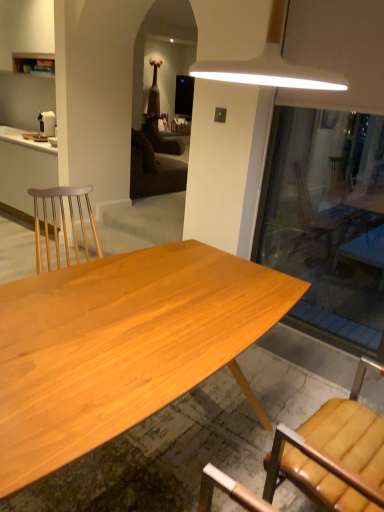
Question: Is matte white cabinet at left aimed at white plastic coffee maker at left?

Choices:
 (A) no
 (B) yes

Answer: (A)

Question: Is matte white cabinet at left positioned far away from white plastic coffee maker at left?

Choices:
 (A) no
 (B) yes

Answer: (A)

Question: Is the surface of matte white cabinet at left in direct contact with white plastic coffee maker at left?

Choices:
 (A) yes
 (B) no

Answer: (B)

Question: Is matte white cabinet at left looking in the opposite direction of white plastic coffee maker at left?

Choices:
 (A) no
 (B) yes

Answer: (A)

Question: Can you confirm if matte white cabinet at left is shorter than white plastic coffee maker at left?

Choices:
 (A) yes
 (B) no

Answer: (B)

Question: Is matte white cabinet at left thinner than white plastic coffee maker at left?

Choices:
 (A) no
 (B) yes

Answer: (A)

Question: Is natural wood desk at center a part of white plastic coffee maker at left?

Choices:
 (A) yes
 (B) no

Answer: (B)

Question: From the image's perspective, is white plastic coffee maker at left on top of natural wood desk at center?

Choices:
 (A) yes
 (B) no

Answer: (A)

Question: Considering the relative sizes of white plastic coffee maker at left and natural wood desk at center in the image provided, is white plastic coffee maker at left wider than natural wood desk at center?

Choices:
 (A) yes
 (B) no

Answer: (B)

Question: From a real-world perspective, is white plastic coffee maker at left below natural wood desk at center?

Choices:
 (A) no
 (B) yes

Answer: (A)

Question: Is white plastic coffee maker at left smaller than natural wood desk at center?

Choices:
 (A) no
 (B) yes

Answer: (B)

Question: Is white plastic coffee maker at left outside of natural wood desk at center?

Choices:
 (A) no
 (B) yes

Answer: (B)

Question: From a real-world perspective, is natural wood desk at center positioned over white plastic coffee maker at left based on gravity?

Choices:
 (A) no
 (B) yes

Answer: (A)